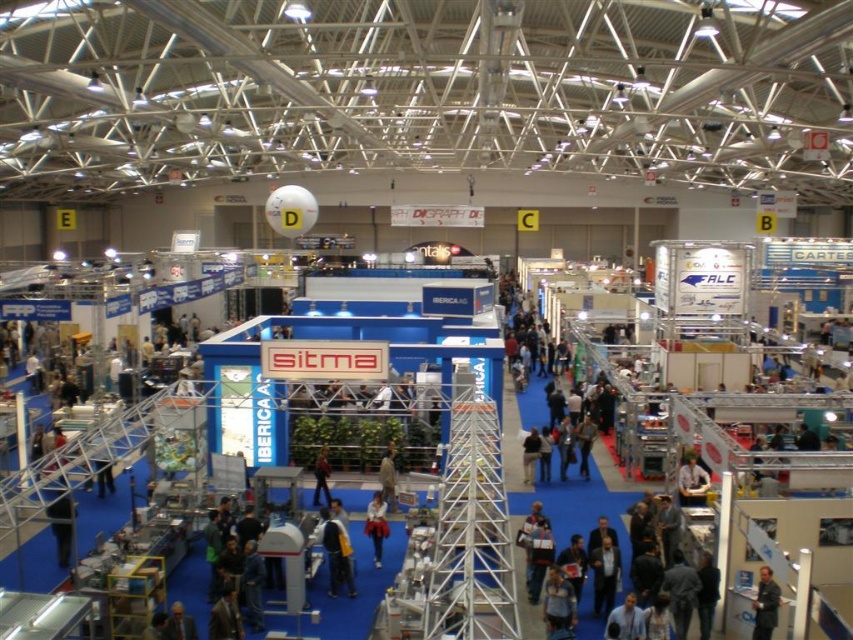
You are an attendee at the exhibition and want to take a photo of the dark blue shirt at center and the dark blue jeans at center. Since both are dark blue, will you be able to distinguish them in your photo?

The dark blue shirt at center is in front of dark blue jeans at center, so in the photo, the dark blue shirt at center will appear in front of the dark blue jeans at center, making them distinguishable by their positions.

You are standing at the camera position in the exhibition hall and need to reach the dark blue jacket at center. The hall has a clear path except for a 50 feet long obstacle starting 30 feet away from you. Can you safely navigate to the jacket without encountering the obstacle?

The dark blue jacket at center is 63.42 feet away. The obstacle starts at 30 feet and is 50 feet long, meaning it extends from 30 to 80 feet. Since the jacket is at 63.42 feet, which is within the obstacle range, you cannot safely reach it without encountering the obstacle.

You are navigating through the exhibition hall and need to locate two points marked on the floor. The first point is labeled as point (337,579) and the second is point (390,474). If you are facing the direction of the SITMA booth, which point should you move towards first to reach the one in front?

Point (337,579) is in front of point (390,474). Since you are facing the SITMA booth, you should move towards point (337,579) first as it is closer to your current facing direction.